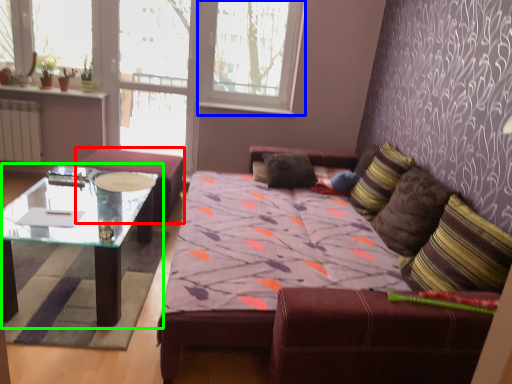
Question: Which object is the farthest from chair (highlighted by a red box)? Choose among these: window frame (highlighted by a blue box) or coffee table (highlighted by a green box).

Choices:
 (A) window frame
 (B) coffee table

Answer: (A)